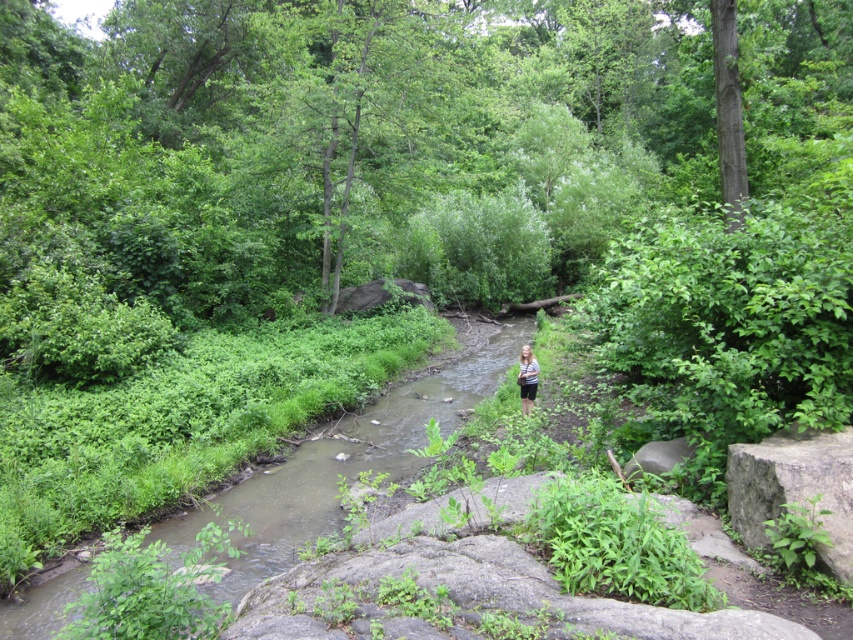
Question: Does gray rough stone at lower right appear under striped fabric shirt at center?

Choices:
 (A) no
 (B) yes

Answer: (A)

Question: Considering the relative positions of gray rough stone at lower right and striped fabric shirt at center in the image provided, where is gray rough stone at lower right located with respect to striped fabric shirt at center?

Choices:
 (A) left
 (B) right

Answer: (B)

Question: Which object is closer to the camera taking this photo?

Choices:
 (A) clear water stream at center
 (B) striped fabric shirt at center

Answer: (A)

Question: Which point is closer to the camera?

Choices:
 (A) (845, 576)
 (B) (398, 397)
 (C) (535, 380)

Answer: (A)

Question: Which point is farther from the camera taking this photo?

Choices:
 (A) (523, 380)
 (B) (271, 552)
 (C) (750, 445)

Answer: (A)

Question: Does clear water stream at center appear on the left side of gray rough stone at lower right?

Choices:
 (A) yes
 (B) no

Answer: (A)